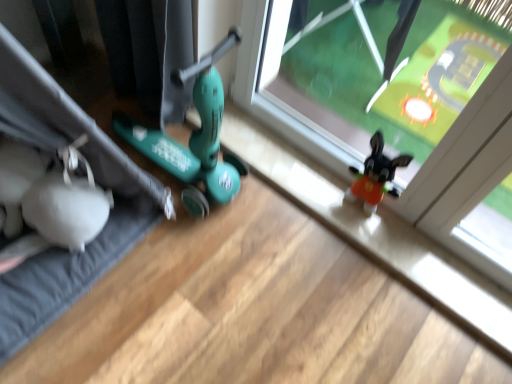
Describe the element at coordinates (96, 181) in the screenshot. I see `white fabric yoga mat at left` at that location.

Where is `white fabric yoga mat at left`? white fabric yoga mat at left is located at coordinates (96, 181).

In order to click on transparent plastic window at center in this screenshot , I will do `click(396, 107)`.

What do you see at coordinates (396, 107) in the screenshot? I see `transparent plastic window at center` at bounding box center [396, 107].

Find the location of a particular element. The width and height of the screenshot is (512, 384). white fabric yoga mat at left is located at coordinates (96, 181).

Considering the positions of objects transparent plastic window at center and white fabric yoga mat at left in the image provided, who is more to the right, transparent plastic window at center or white fabric yoga mat at left?

transparent plastic window at center.

Which object is more forward, transparent plastic window at center or white fabric yoga mat at left?

white fabric yoga mat at left is closer to the camera.

Is point (449, 17) more distant than point (52, 124)?

That is True.

From the image's perspective, which is below, transparent plastic window at center or white fabric yoga mat at left?

white fabric yoga mat at left appears lower in the image.

From a real-world perspective, which object rests below the other?

transparent plastic window at center is physically lower.

Does transparent plastic window at center have a greater width compared to white fabric yoga mat at left?

Incorrect, the width of transparent plastic window at center does not surpass that of white fabric yoga mat at left.

Who is taller, transparent plastic window at center or white fabric yoga mat at left?

Standing taller between the two is white fabric yoga mat at left.

Considering the sizes of objects transparent plastic window at center and white fabric yoga mat at left in the image provided, who is bigger, transparent plastic window at center or white fabric yoga mat at left?

white fabric yoga mat at left is bigger.

Would you say transparent plastic window at center is inside or outside white fabric yoga mat at left?

transparent plastic window at center cannot be found inside white fabric yoga mat at left.

Are transparent plastic window at center and white fabric yoga mat at left located far from each other?

No, transparent plastic window at center is in close proximity to white fabric yoga mat at left.

Is transparent plastic window at center positioned with its back to white fabric yoga mat at left?

No, transparent plastic window at center is not facing away from white fabric yoga mat at left.

How different are the orientations of transparent plastic window at center and white fabric yoga mat at left in degrees?

89.1 degrees separate the facing orientations of transparent plastic window at center and white fabric yoga mat at left.

The height and width of the screenshot is (384, 512). What are the coordinates of `window behind the white fabric yoga mat at left` in the screenshot? It's located at (396, 107).

Is white fabric yoga mat at left to the right of transparent plastic window at center from the viewer's perspective?

No, white fabric yoga mat at left is not to the right of transparent plastic window at center.

Is white fabric yoga mat at left in front of transparent plastic window at center?

Yes, white fabric yoga mat at left is in front of transparent plastic window at center.

Between point (154, 191) and point (392, 106), which one is positioned behind?

The point (392, 106) is farther.

From the image's perspective, between white fabric yoga mat at left and transparent plastic window at center, which one is located above?

transparent plastic window at center.

From a real-world perspective, which object rests below the other?

transparent plastic window at center is physically lower.

Considering the sizes of objects white fabric yoga mat at left and transparent plastic window at center in the image provided, who is thinner, white fabric yoga mat at left or transparent plastic window at center?

transparent plastic window at center.

Who is shorter, white fabric yoga mat at left or transparent plastic window at center?

transparent plastic window at center is shorter.

Who is bigger, white fabric yoga mat at left or transparent plastic window at center?

With larger size is white fabric yoga mat at left.

Is white fabric yoga mat at left located outside transparent plastic window at center?

Yes, white fabric yoga mat at left is not within transparent plastic window at center.

Are white fabric yoga mat at left and transparent plastic window at center far apart?

They are positioned close to each other.

Is white fabric yoga mat at left oriented away from transparent plastic window at center?

No, white fabric yoga mat at left's orientation is not away from transparent plastic window at center.

This screenshot has height=384, width=512. I want to click on window on the right side of white fabric yoga mat at left, so click(x=396, y=107).

The height and width of the screenshot is (384, 512). In order to click on yoga mat in front of the transparent plastic window at center in this screenshot , I will do `click(96, 181)`.

The height and width of the screenshot is (384, 512). There is a transparent plastic window at center. In order to click on yoga mat above it (from a real-world perspective) in this screenshot , I will do `click(96, 181)`.